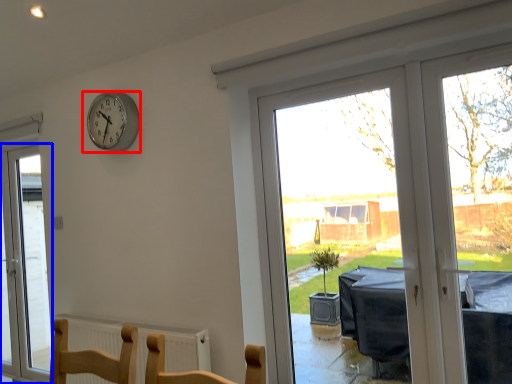
Question: Among these objects, which one is farthest to the camera, wall clock (highlighted by a red box) or window (highlighted by a blue box)?

Choices:
 (A) wall clock
 (B) window

Answer: (B)